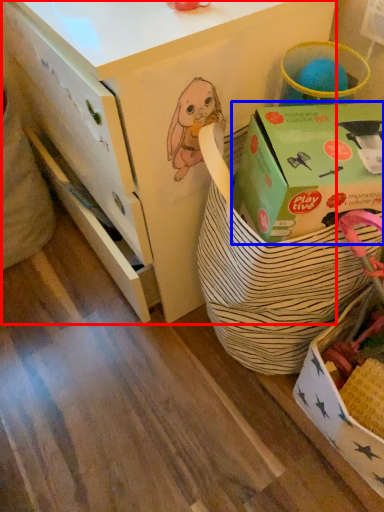
Question: Which point is further to the camera, desk (highlighted by a red box) or box (highlighted by a blue box)?

Choices:
 (A) desk
 (B) box

Answer: (A)